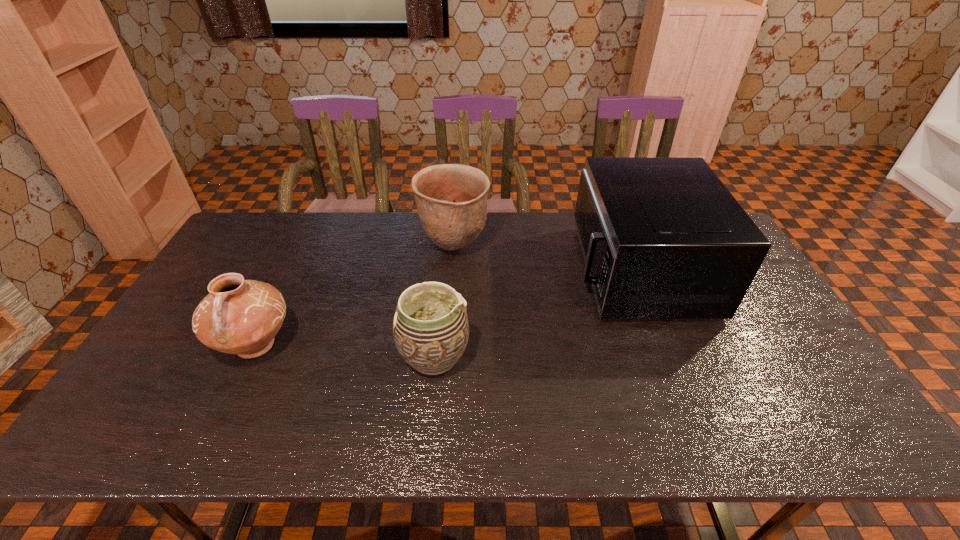
At what (x,y) coordinates should I click in order to perform the action: click on empty space that is in between the rightmost object and the farthest pottery. Please return your answer as a coordinate pair (x, y). The width and height of the screenshot is (960, 540). Looking at the image, I should click on (545, 259).

You are a GUI agent. You are given a task and a screenshot of the screen. Output one action in this format:
    pyautogui.click(x=<x>, y=<y>)
    Task: Click on the object that is the third closest to the rightmost object
    The image size is (960, 540).
    Given the screenshot: What is the action you would take?
    pyautogui.click(x=238, y=316)

The width and height of the screenshot is (960, 540). Find the location of `object that is the second closest to the leftmost pottery`. object that is the second closest to the leftmost pottery is located at coordinates (451, 199).

The image size is (960, 540). In order to click on the second closest pottery to the rightmost object in this screenshot , I will do `click(430, 328)`.

Locate which pottery is the second closest to the farthest pottery. Please provide its 2D coordinates. Your answer should be formatted as a tuple, i.e. [(x, y)], where the tuple contains the x and y coordinates of a point satisfying the conditions above.

[(238, 316)]

Find the location of a particular element. The image size is (960, 540). vacant space that satisfies the following two spatial constraints: 1. on the front-facing side of the rightmost object; 2. on the side of the leftmost pottery with the handle is located at coordinates (666, 345).

Find the location of a particular element. free space that satisfies the following two spatial constraints: 1. on the front-facing side of the microwave_oven; 2. on the side of the leftmost object with the handle is located at coordinates click(666, 345).

Identify the location of free space that satisfies the following two spatial constraints: 1. on the front-facing side of the microwave_oven; 2. on the side of the leftmost object with the handle. This screenshot has width=960, height=540. (666, 345).